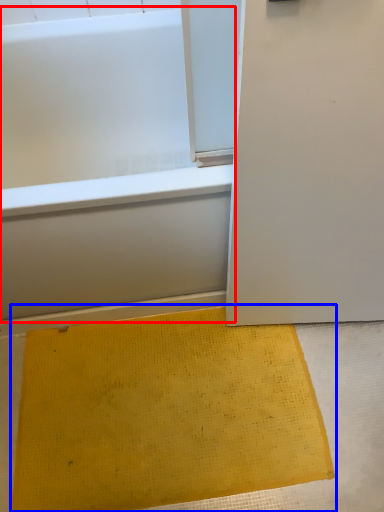
Question: Which object is further to the camera taking this photo, bathtub (highlighted by a red box) or doormat (highlighted by a blue box)?

Choices:
 (A) bathtub
 (B) doormat

Answer: (B)